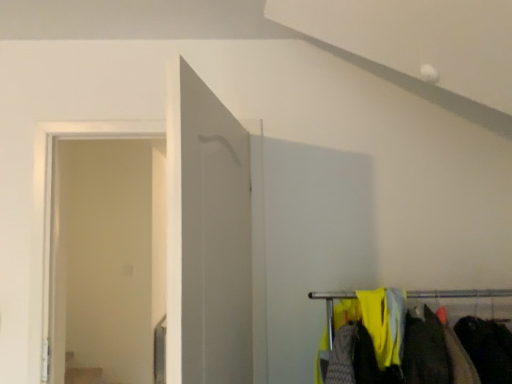
Describe the element at coordinates (106, 257) in the screenshot. I see `transparent glass door at left` at that location.

The height and width of the screenshot is (384, 512). What do you see at coordinates (487, 348) in the screenshot? I see `dark gray fabric at lower right` at bounding box center [487, 348].

In order to face dark gray fabric at lower right, should I rotate leftwards or rightwards?

Rotate your view right by about 28.786°.

What do you see at coordinates (214, 238) in the screenshot? I see `white glossy door at center` at bounding box center [214, 238].

Image resolution: width=512 pixels, height=384 pixels. What are the coordinates of `transparent glass door at left` in the screenshot? It's located at (106, 257).

Identify the location of glass door that appears on the left of dark gray fabric at lower right. This screenshot has width=512, height=384. (106, 257).

Measure the distance from transparent glass door at left to dark gray fabric at lower right.

3.14 meters.

Does transparent glass door at left turn towards dark gray fabric at lower right?

No, transparent glass door at left is not turned towards dark gray fabric at lower right.

How many degrees apart are the facing directions of transparent glass door at left and dark gray fabric at lower right?

12 degrees.

Does point (205, 238) lie behind point (109, 184)?

No, (205, 238) is in front of (109, 184).

Between white glossy door at center and transparent glass door at left, which one has more height?

Standing taller between the two is transparent glass door at left.

From a real-world perspective, is white glossy door at center positioned above or below transparent glass door at left?

From a real-world perspective, white glossy door at center is physically above transparent glass door at left.

Is dark gray fabric at lower right aimed at white glossy door at center?

No, dark gray fabric at lower right is not facing towards white glossy door at center.

Based on their positions, is dark gray fabric at lower right located to the left or right of white glossy door at center?

From the image, it's evident that dark gray fabric at lower right is to the right of white glossy door at center.

From a real-world perspective, between dark gray fabric at lower right and white glossy door at center, who is vertically higher?

white glossy door at center, from a real-world perspective.

Is point (501, 327) positioned in front of point (228, 360)?

No, it is behind (228, 360).

From the image's perspective, is dark gray fabric at lower right above transparent glass door at left?

No, from the image's perspective, dark gray fabric at lower right is not on top of transparent glass door at left.

Would you say dark gray fabric at lower right is inside or outside transparent glass door at left?

dark gray fabric at lower right lies outside transparent glass door at left.

Does dark gray fabric at lower right have a smaller size compared to transparent glass door at left?

Correct, dark gray fabric at lower right occupies less space than transparent glass door at left.

Is point (75, 342) behind point (234, 276)?

Yes, point (75, 342) is behind point (234, 276).

From the picture: Based on their sizes in the image, would you say transparent glass door at left is bigger or smaller than white glossy door at center?

Clearly, transparent glass door at left is larger in size than white glossy door at center.

Would you say transparent glass door at left is a long distance from white glossy door at center?

Absolutely, transparent glass door at left is distant from white glossy door at center.

Looking at their sizes, would you say white glossy door at center is wider or thinner than dark gray fabric at lower right?

white glossy door at center is thinner than dark gray fabric at lower right.

In the image, there is a white glossy door at center. Identify the location of clothing below it (from the image's perspective). (487, 348).

Which is more to the right, white glossy door at center or dark gray fabric at lower right?

From the viewer's perspective, dark gray fabric at lower right appears more on the right side.

Are white glossy door at center and dark gray fabric at lower right making contact?

There is a gap between white glossy door at center and dark gray fabric at lower right.

Find the location of a particular element. The image size is (512, 384). glass door above the dark gray fabric at lower right (from the image's perspective) is located at coordinates (106, 257).

Where is `glass door lying on the left of white glossy door at center`? This screenshot has height=384, width=512. glass door lying on the left of white glossy door at center is located at coordinates (106, 257).

Considering their positions, is transparent glass door at left positioned closer to white glossy door at center than dark gray fabric at lower right?

dark gray fabric at lower right lies closer to white glossy door at center than the other object.

From the image, which object appears to be farther from dark gray fabric at lower right, white glossy door at center or transparent glass door at left?

transparent glass door at left is further to dark gray fabric at lower right.

Considering their positions, is white glossy door at center positioned further to transparent glass door at left than dark gray fabric at lower right?

The object further to transparent glass door at left is dark gray fabric at lower right.

Which object lies nearer to the anchor point transparent glass door at left, dark gray fabric at lower right or white glossy door at center?

white glossy door at center is positioned closer to the anchor transparent glass door at left.

Looking at the image, which one is located further to dark gray fabric at lower right, transparent glass door at left or white glossy door at center?

transparent glass door at left is further to dark gray fabric at lower right.

In the scene shown: From the image, which object appears to be farther from white glossy door at center, dark gray fabric at lower right or transparent glass door at left?

transparent glass door at left is positioned further to the anchor white glossy door at center.

The image size is (512, 384). Find the location of `door situated between transparent glass door at left and dark gray fabric at lower right from left to right`. door situated between transparent glass door at left and dark gray fabric at lower right from left to right is located at coordinates (214, 238).